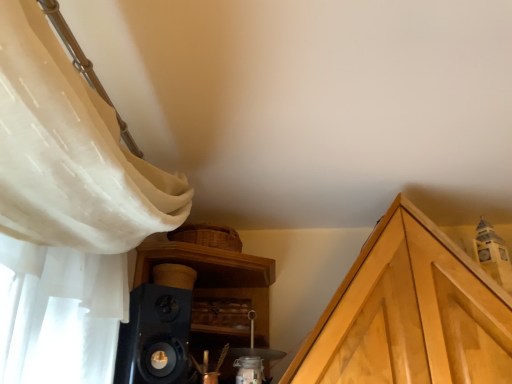
Question: From a real-world perspective, relative to light wood cabinetry at upper right, is black matte speaker at lower left vertically above or below?

Choices:
 (A) below
 (B) above

Answer: (A)

Question: Choose the correct answer: Is black matte speaker at lower left inside light wood cabinetry at upper right or outside it?

Choices:
 (A) inside
 (B) outside

Answer: (B)

Question: Considering the relative positions of black matte speaker at lower left and light wood cabinetry at upper right in the image provided, is black matte speaker at lower left to the left or to the right of light wood cabinetry at upper right?

Choices:
 (A) left
 (B) right

Answer: (A)

Question: Is light wood cabinetry at upper right in front of or behind black matte speaker at lower left in the image?

Choices:
 (A) front
 (B) behind

Answer: (B)

Question: From a real-world perspective, relative to black matte speaker at lower left, is light wood cabinetry at upper right vertically above or below?

Choices:
 (A) above
 (B) below

Answer: (A)

Question: From the image's perspective, is light wood cabinetry at upper right above or below black matte speaker at lower left?

Choices:
 (A) above
 (B) below

Answer: (B)

Question: Which is correct: light wood cabinetry at upper right is inside black matte speaker at lower left, or outside of it?

Choices:
 (A) outside
 (B) inside

Answer: (A)